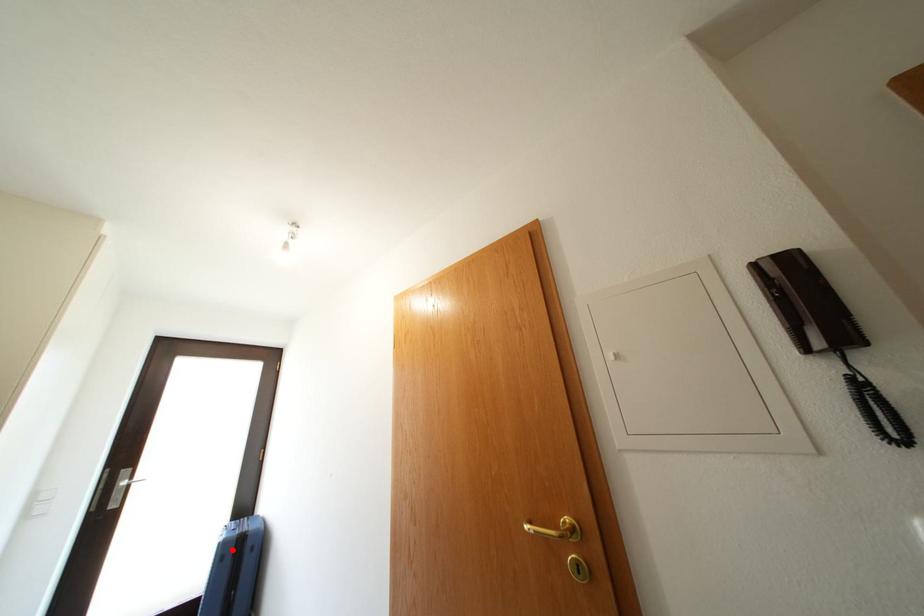
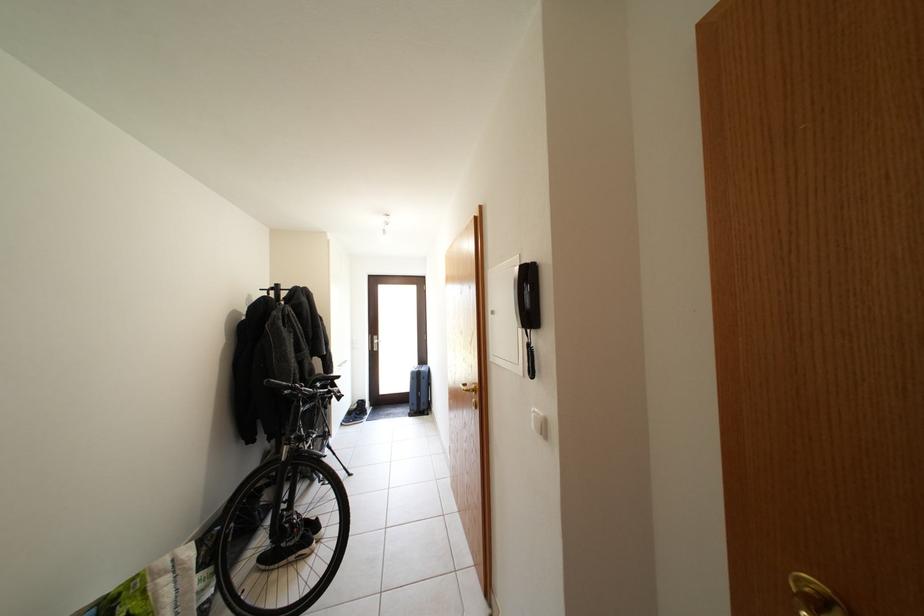
Question: I am providing you with two images of the same scene from different viewpoints. A red point is marked on the first image. At the location where the point appears in image 1, is it still visible in image 2?

Choices:
 (A) Yes
 (B) No

Answer: (A)